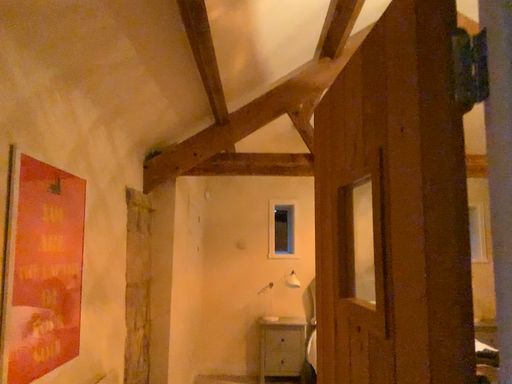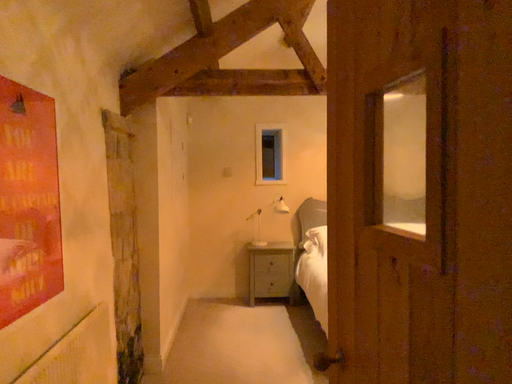
Question: How did the camera likely rotate when shooting the video?

Choices:
 (A) rotated upward
 (B) rotated downward

Answer: (B)